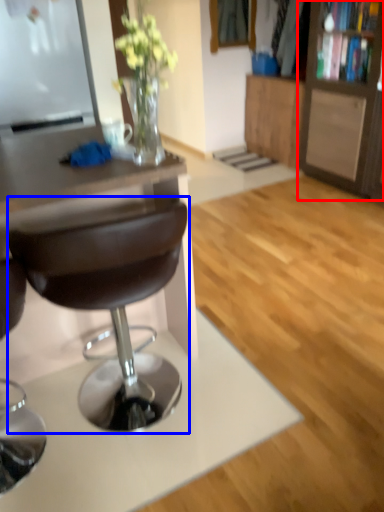
Question: Which point is closer to the camera, cabinetry (highlighted by a red box) or chair (highlighted by a blue box)?

Choices:
 (A) cabinetry
 (B) chair

Answer: (B)